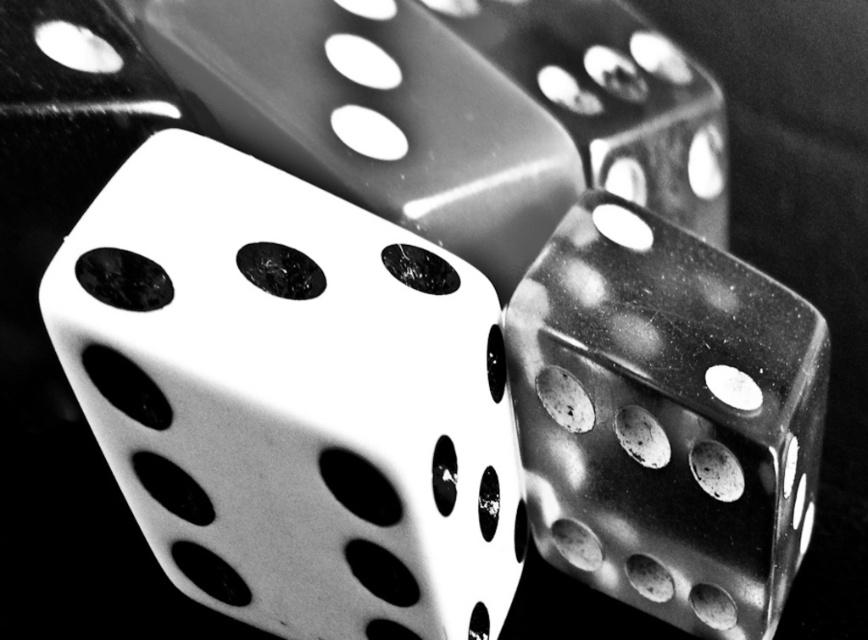
Question: Where is translucent plastic dice at center located in relation to metallic dice at center in the image?

Choices:
 (A) below
 (B) above

Answer: (A)

Question: Can you confirm if white matte dice at center is positioned below metallic dice at center?

Choices:
 (A) no
 (B) yes

Answer: (B)

Question: Which point is farther from the camera taking this photo?

Choices:
 (A) (195, 45)
 (B) (415, 282)

Answer: (A)

Question: Does white matte dice at center appear under translucent plastic dice at center?

Choices:
 (A) no
 (B) yes

Answer: (B)

Question: Estimate the real-world distances between objects in this image. Which object is closer to the translucent plastic dice at center?

Choices:
 (A) metallic dice at center
 (B) white glossy dice at center
 (C) white matte dice at center

Answer: (C)

Question: Among these points, which one is nearest to the camera?

Choices:
 (A) (595, 36)
 (B) (442, 58)
 (C) (485, 508)

Answer: (C)